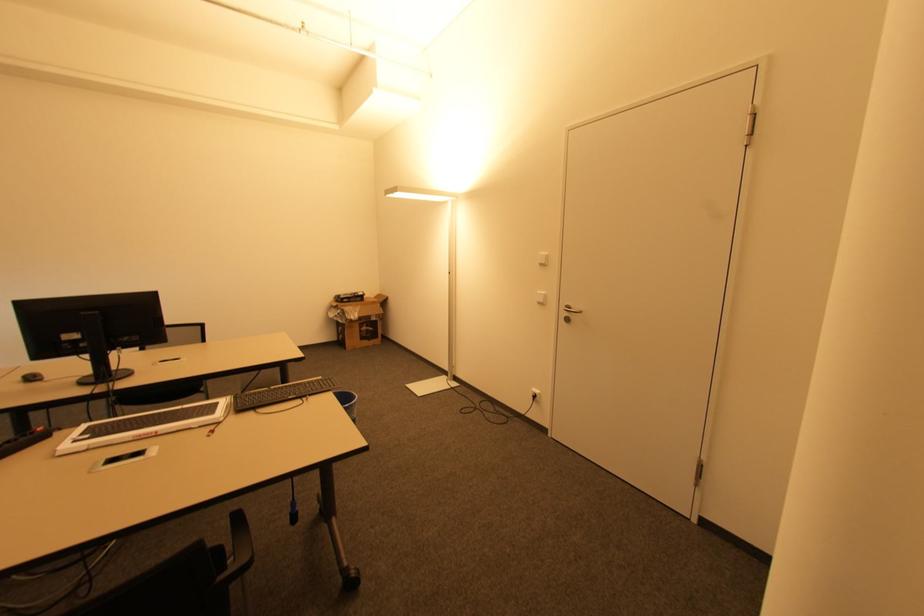
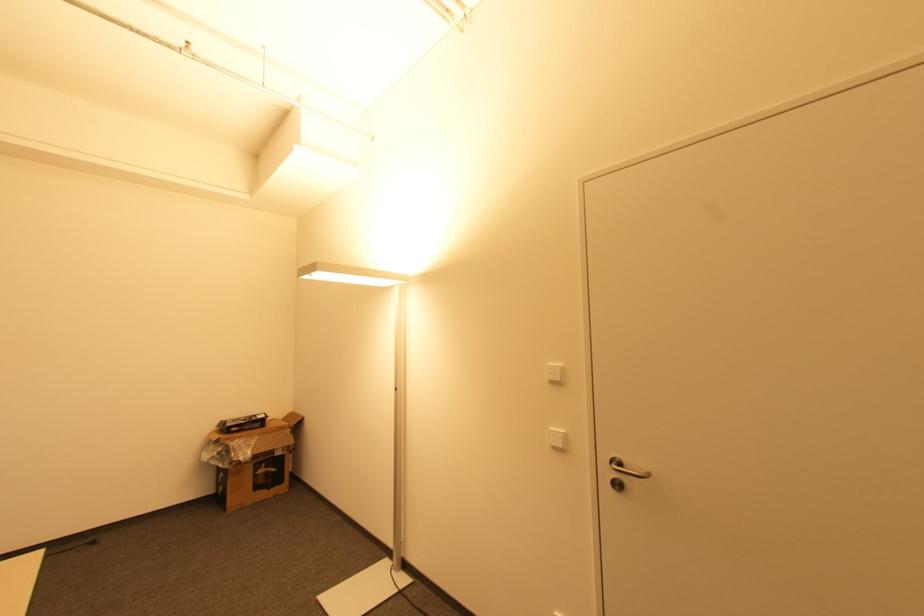
The point at [541,302] is marked in the first image. Where is the corresponding point in the second image?

(557, 448)